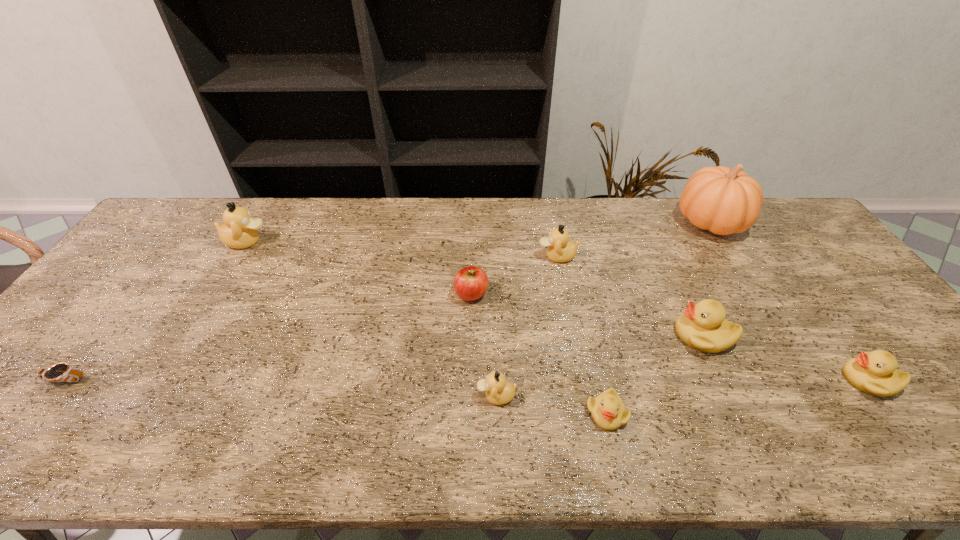
The height and width of the screenshot is (540, 960). What are the coordinates of `free spot located on the face of the second tan duckling from right to left` in the screenshot? It's located at (304, 396).

Where is `vacant region located on the face of the second tan duckling from right to left`? This screenshot has width=960, height=540. vacant region located on the face of the second tan duckling from right to left is located at coordinates (369, 396).

Locate an element on the screen. The height and width of the screenshot is (540, 960). free location located 0.050m on the front-facing side of the smallest yellow duckling is located at coordinates (616, 455).

This screenshot has width=960, height=540. I want to click on vacant space located 0.360m on the right of the leftmost object, so click(x=238, y=379).

Identify the location of pumpkin that is at the far edge. (724, 201).

You are a GUI agent. You are given a task and a screenshot of the screen. Output one action in this format:
    pyautogui.click(x=<x>, y=<y>)
    Task: Click on the duckling located in the far edge section of the desktop
    This screenshot has height=540, width=960.
    Given the screenshot: What is the action you would take?
    pyautogui.click(x=240, y=230)

Find the location of `object located in the near edge section of the desktop`. object located in the near edge section of the desktop is located at coordinates (608, 411).

At what (x,y) coordinates should I click in order to perform the action: click on object located at the left edge. Please return your answer as a coordinate pair (x, y). Image resolution: width=960 pixels, height=540 pixels. Looking at the image, I should click on (61, 372).

You are a GUI agent. You are given a task and a screenshot of the screen. Output one action in this format:
    pyautogui.click(x=<x>, y=<y>)
    Task: Click on the object situated at the right edge
    The width and height of the screenshot is (960, 540).
    Given the screenshot: What is the action you would take?
    pyautogui.click(x=875, y=373)

At what (x,y) coordinates should I click in order to perform the action: click on vacant region at the far edge of the desktop. Please return your answer as a coordinate pair (x, y). The image size is (960, 540). Looking at the image, I should click on (365, 233).